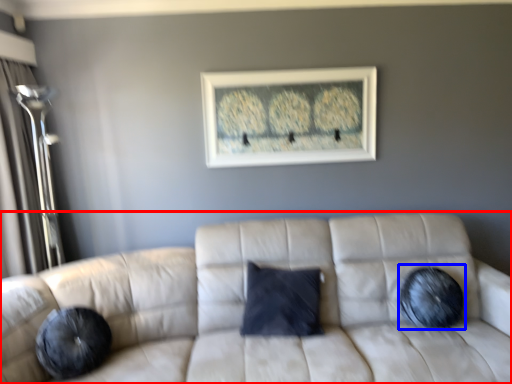
Question: Which object is further to the camera taking this photo, studio couch (highlighted by a red box) or pillow (highlighted by a blue box)?

Choices:
 (A) studio couch
 (B) pillow

Answer: (B)